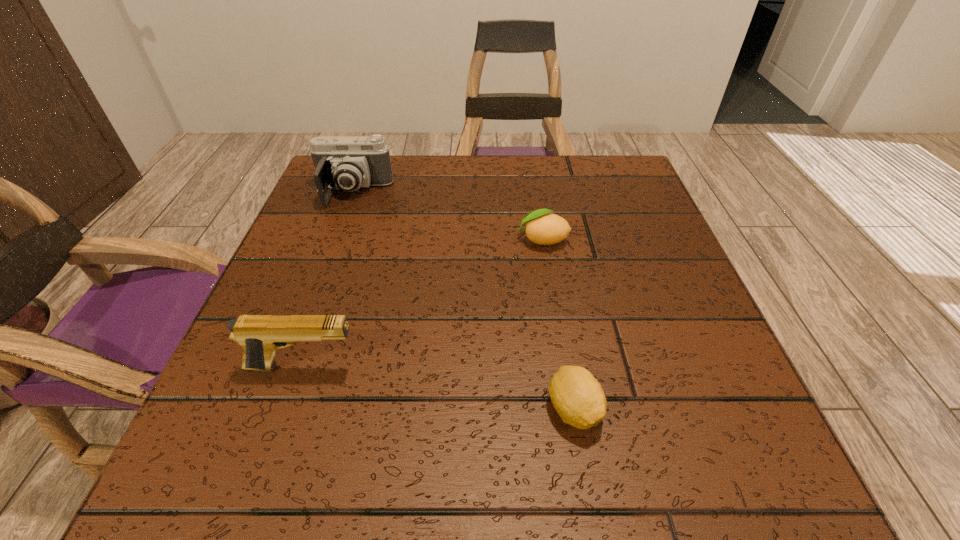
The image size is (960, 540). In order to click on object that is at the near edge in this screenshot , I will do `click(577, 396)`.

You are a GUI agent. You are given a task and a screenshot of the screen. Output one action in this format:
    pyautogui.click(x=<x>, y=<y>)
    Task: Click on the camera that is positioned at the left edge
    This screenshot has height=540, width=960.
    Given the screenshot: What is the action you would take?
    pyautogui.click(x=343, y=162)

Find the location of a particular element. pistol that is at the left edge is located at coordinates (260, 335).

Identify the location of object present at the far left corner. (343, 162).

Identify the location of free region at the far edge. (493, 210).

At what (x,y) coordinates should I click in order to perform the action: click on free region at the near edge of the desktop. Please return your answer as a coordinate pair (x, y). The width and height of the screenshot is (960, 540). Looking at the image, I should click on (625, 490).

This screenshot has height=540, width=960. Find the location of `vacant space at the left edge of the desktop`. vacant space at the left edge of the desktop is located at coordinates (283, 288).

The width and height of the screenshot is (960, 540). Identify the location of vacant area at the right edge. [x=591, y=213].

Where is `blank space at the far right corner of the desktop`? Image resolution: width=960 pixels, height=540 pixels. blank space at the far right corner of the desktop is located at coordinates coord(614,154).

Find the location of `vacant space at the near right corner of the desktop`. vacant space at the near right corner of the desktop is located at coordinates (783, 481).